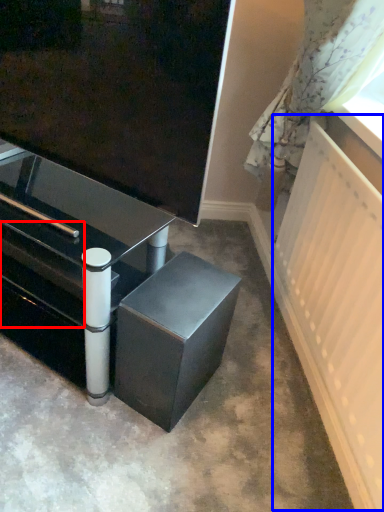
Question: Which object is closer to the camera taking this photo, drawer (highlighted by a red box) or radiator (highlighted by a blue box)?

Choices:
 (A) drawer
 (B) radiator

Answer: (B)